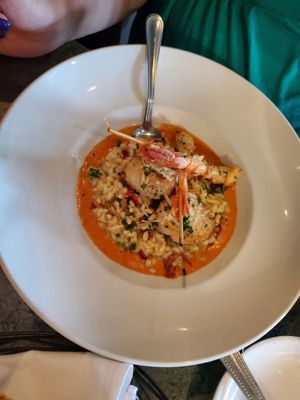
At what (x,y) coordinates should I click in order to perform the action: click on plates with food. Please return your answer as a coordinate pair (x, y). The image size is (300, 400). Looking at the image, I should click on (39, 221).